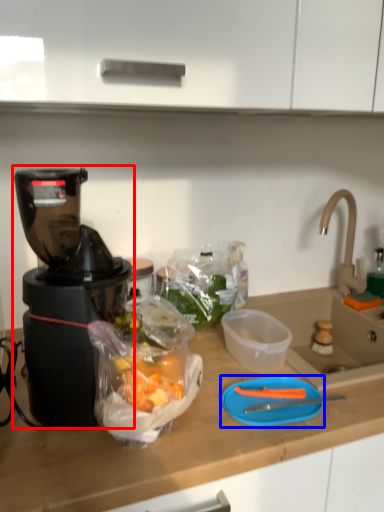
Question: Which point is further to the camera, blender (highlighted by a red box) or cutting board (highlighted by a blue box)?

Choices:
 (A) blender
 (B) cutting board

Answer: (B)